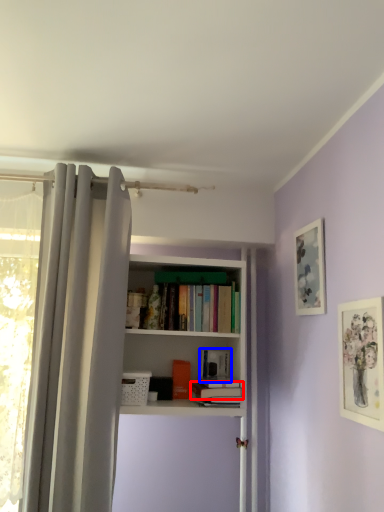
Question: Which object appears farthest to the camera in this image, book (highlighted by a red box) or book (highlighted by a blue box)?

Choices:
 (A) book
 (B) book

Answer: (B)